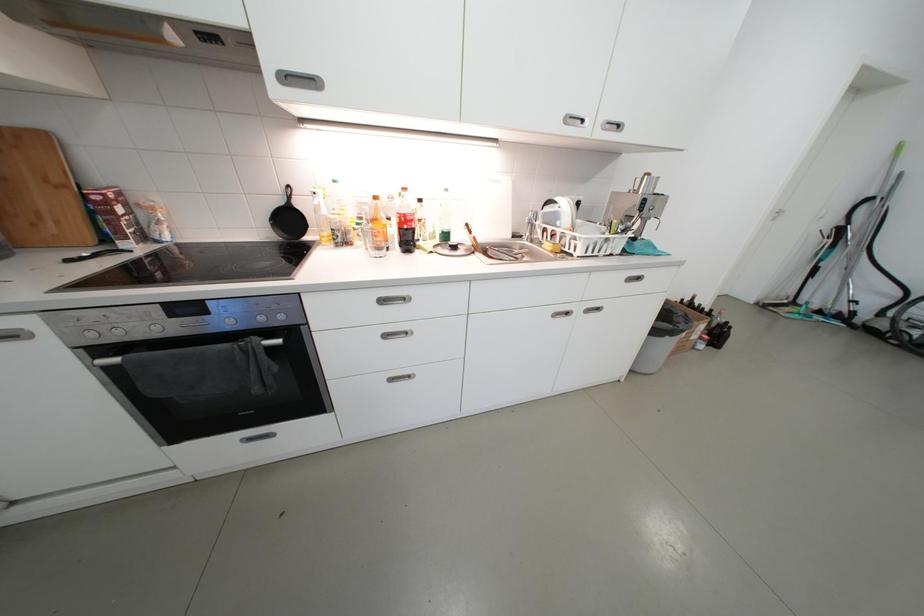
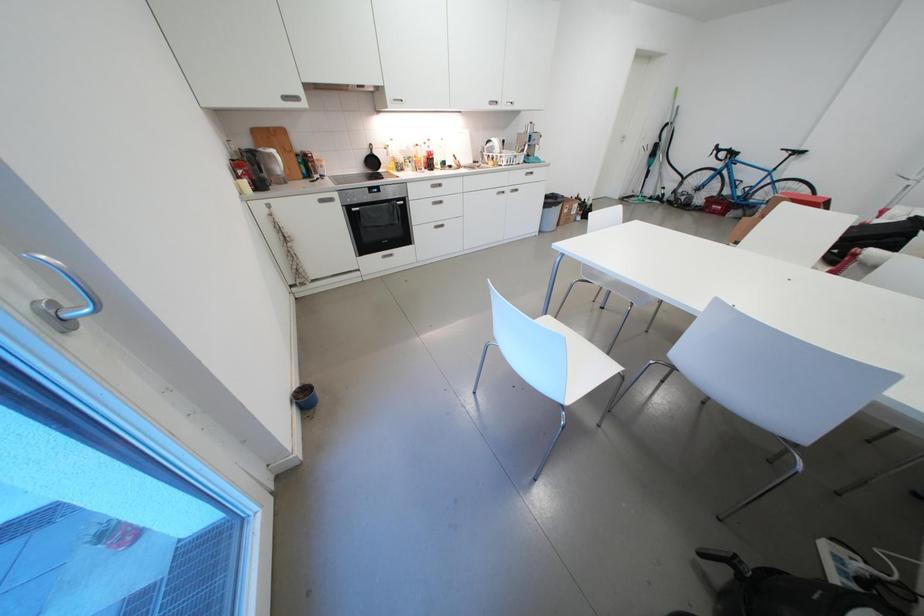
Question: What movement of the cameraman would produce the second image?

Choices:
 (A) Left
 (B) Right
 (C) Forward
 (D) Backward

Answer: (D)